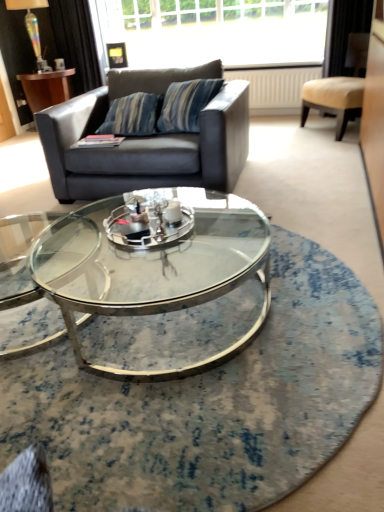
Question: From a real-world perspective, is clear glass coffee table at center located higher than black velvet curtain at upper left?

Choices:
 (A) no
 (B) yes

Answer: (A)

Question: Considering the relative sizes of clear glass coffee table at center and black velvet curtain at upper left in the image provided, is clear glass coffee table at center bigger than black velvet curtain at upper left?

Choices:
 (A) no
 (B) yes

Answer: (B)

Question: Can you confirm if clear glass coffee table at center is positioned to the right of black velvet curtain at upper left?

Choices:
 (A) no
 (B) yes

Answer: (B)

Question: Considering the relative sizes of clear glass coffee table at center and black velvet curtain at upper left in the image provided, is clear glass coffee table at center wider than black velvet curtain at upper left?

Choices:
 (A) no
 (B) yes

Answer: (B)

Question: Does clear glass coffee table at center contain black velvet curtain at upper left?

Choices:
 (A) no
 (B) yes

Answer: (A)

Question: Is clear glass coffee table at center smaller than black velvet curtain at upper left?

Choices:
 (A) yes
 (B) no

Answer: (B)

Question: Considering the relative sizes of black velvet curtain at upper left and clear glass window at upper center in the image provided, is black velvet curtain at upper left taller than clear glass window at upper center?

Choices:
 (A) yes
 (B) no

Answer: (A)

Question: Does black velvet curtain at upper left have a larger size compared to clear glass window at upper center?

Choices:
 (A) no
 (B) yes

Answer: (A)

Question: Is clear glass window at upper center located within black velvet curtain at upper left?

Choices:
 (A) no
 (B) yes

Answer: (A)

Question: Can you confirm if black velvet curtain at upper left is thinner than clear glass window at upper center?

Choices:
 (A) no
 (B) yes

Answer: (B)

Question: Is black velvet curtain at upper left smaller than clear glass window at upper center?

Choices:
 (A) no
 (B) yes

Answer: (B)

Question: Is there a large distance between black velvet curtain at upper left and clear glass window at upper center?

Choices:
 (A) yes
 (B) no

Answer: (B)

Question: Is black velvet curtain at upper left to the right of beige leather chair at upper right from the viewer's perspective?

Choices:
 (A) yes
 (B) no

Answer: (B)